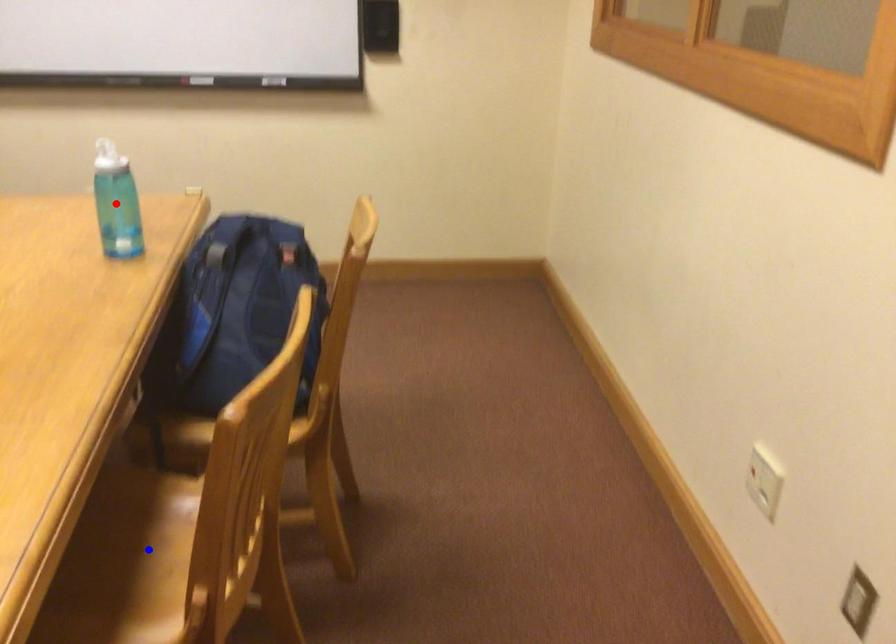
Question: Two points are marked on the image. Which point is closer to the camera?

Choices:
 (A) Blue point is closer.
 (B) Red point is closer.

Answer: (A)